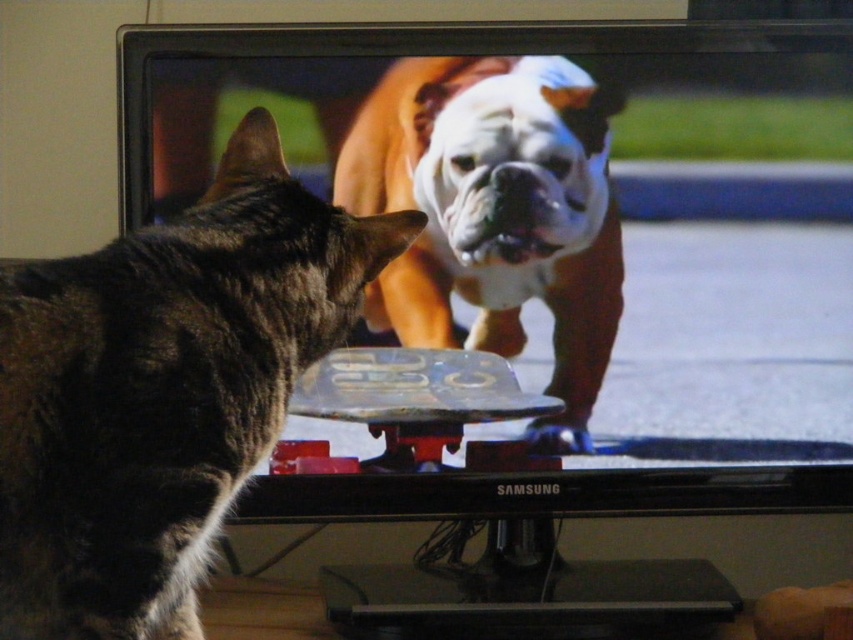
You are a photographer trying to capture a candid shot of both the dark brown fur cat at left and the white fur dog at center in the frame. Based on their positions, will the cat be in front of or behind the dog in the photo?

The dark brown fur cat at left is positioned under the white fur dog at center, so in the photo, the cat will be behind the dog because it is lower in the frame.

You are designing a pet carrier that needs to accommodate both the dark brown fur cat at left and the white fur dog at center. Based on their sizes, which pet requires a wider space in the carrier?

The white fur dog at center requires a wider space in the carrier because it is thicker than the dark brown fur cat at left.

You are a photographer trying to capture a photo of the dark brown fur cat at left and the white fur dog at center. Since you want both subjects to be in focus, you need to know their positions relative to each other. Which one is positioned to the left of the other?

The dark brown fur cat at left is positioned to the left of the white fur dog at center.